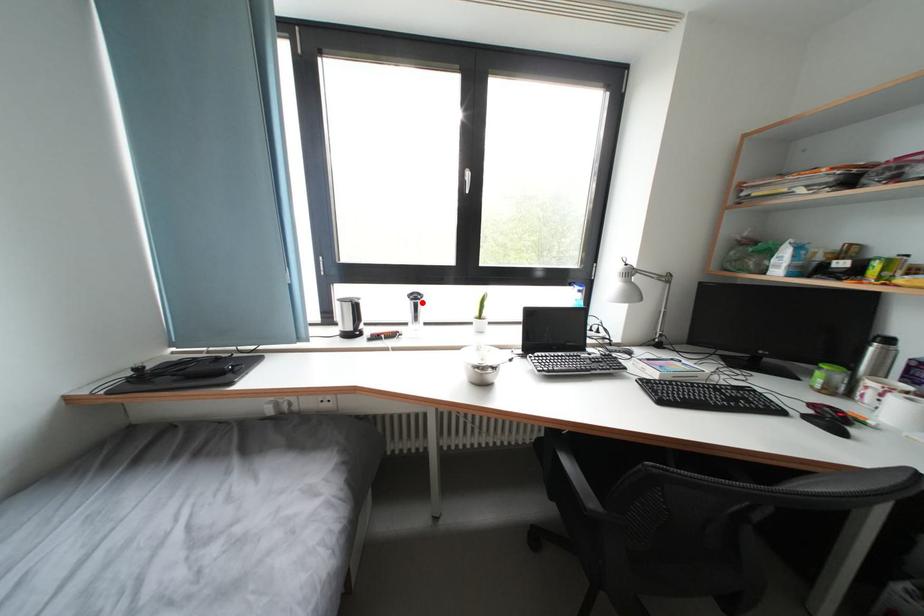
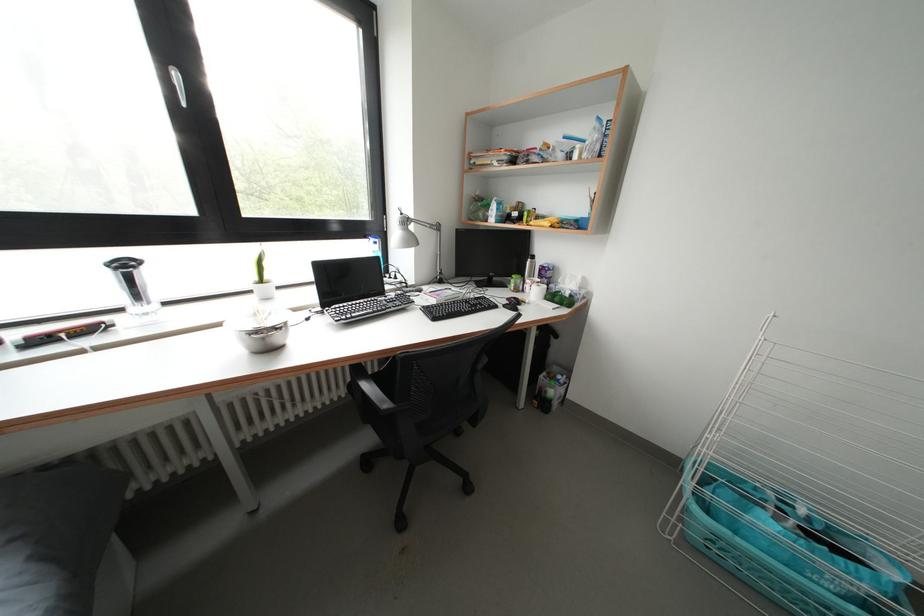
The point at the highlighted location is marked in the first image. Where is the corresponding point in the second image?

(131, 270)